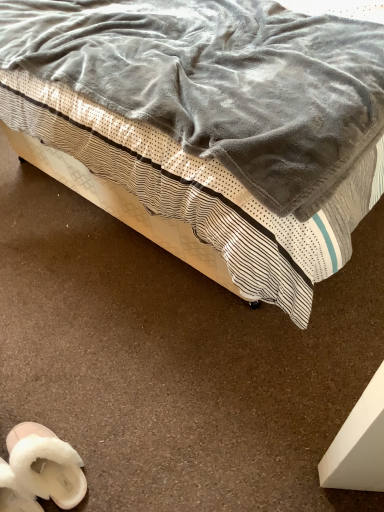
Question: From the image's perspective, is velvet gray blanket at upper center on top of white fluffy slippers at lower left, marked as the second footwear in a left-to-right arrangement?

Choices:
 (A) no
 (B) yes

Answer: (B)

Question: Is velvet gray blanket at upper center oriented away from white fluffy slippers at lower left, marked as the first footwear in a right-to-left arrangement?

Choices:
 (A) no
 (B) yes

Answer: (A)

Question: From a real-world perspective, is velvet gray blanket at upper center physically above white fluffy slippers at lower left, marked as the second footwear in a left-to-right arrangement?

Choices:
 (A) no
 (B) yes

Answer: (B)

Question: From a real-world perspective, is velvet gray blanket at upper center located beneath white fluffy slippers at lower left, marked as the second footwear in a left-to-right arrangement?

Choices:
 (A) yes
 (B) no

Answer: (B)

Question: Is velvet gray blanket at upper center thinner than white fluffy slippers at lower left, marked as the second footwear in a left-to-right arrangement?

Choices:
 (A) yes
 (B) no

Answer: (B)

Question: Can white fluffy slippers at lower left, marked as the second footwear in a left-to-right arrangement, be found inside velvet gray blanket at upper center?

Choices:
 (A) yes
 (B) no

Answer: (B)

Question: From a real-world perspective, is white fluffy slippers at lower left, arranged as the 1th footwear when viewed from the left, under velvet gray blanket at upper center?

Choices:
 (A) no
 (B) yes

Answer: (B)

Question: Is white fluffy slippers at lower left, arranged as the 1th footwear when viewed from the left, oriented towards velvet gray blanket at upper center?

Choices:
 (A) yes
 (B) no

Answer: (B)

Question: Does white fluffy slippers at lower left, arranged as the 1th footwear when viewed from the left, have a lesser height compared to velvet gray blanket at upper center?

Choices:
 (A) no
 (B) yes

Answer: (B)

Question: Considering the relative sizes of white fluffy slippers at lower left, arranged as the 1th footwear when viewed from the left, and velvet gray blanket at upper center in the image provided, is white fluffy slippers at lower left, arranged as the 1th footwear when viewed from the left, wider than velvet gray blanket at upper center?

Choices:
 (A) no
 (B) yes

Answer: (A)

Question: Would you say white fluffy slippers at lower left, arranged as the 1th footwear when viewed from the left, contains velvet gray blanket at upper center?

Choices:
 (A) yes
 (B) no

Answer: (B)

Question: From the image's perspective, is white fluffy slippers at lower left, positioned as the second footwear in right-to-left order, on top of velvet gray blanket at upper center?

Choices:
 (A) no
 (B) yes

Answer: (A)

Question: From a real-world perspective, does white fluffy slippers at lower left, marked as the first footwear in a right-to-left arrangement, stand above white fluffy slippers at lower left, positioned as the second footwear in right-to-left order?

Choices:
 (A) yes
 (B) no

Answer: (A)